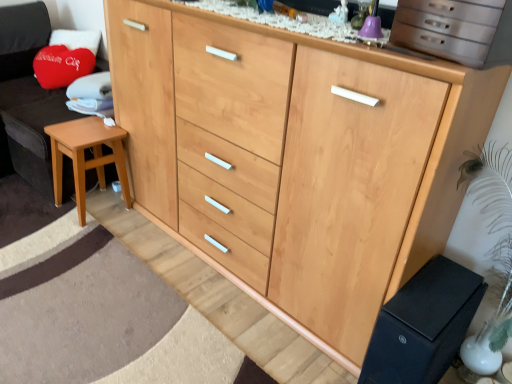
At what (x,y) coordinates should I click in order to perform the action: click on light brown wood stool at lower left. Please return your answer as a coordinate pair (x, y). The image size is (512, 384). Looking at the image, I should click on (87, 160).

Where is `wooden stool at left`? The image size is (512, 384). wooden stool at left is located at coordinates (29, 118).

Find the location of `light brown wood stool at lower left`. light brown wood stool at lower left is located at coordinates (87, 160).

How far apart are black matte changing table at lower right and wooden stool at left?

They are 6.27 feet apart.

Looking at this image, considering the sizes of objects black matte changing table at lower right and wooden stool at left in the image provided, who is thinner, black matte changing table at lower right or wooden stool at left?

black matte changing table at lower right.

I want to click on changing table below the wooden stool at left (from a real-world perspective), so click(423, 325).

From the image's perspective, who appears lower, black matte changing table at lower right or wooden stool at left?

black matte changing table at lower right appears lower in the image.

Is light brown wood stool at lower left spatially inside black matte changing table at lower right, or outside of it?

light brown wood stool at lower left cannot be found inside black matte changing table at lower right.

What's the angular difference between light brown wood stool at lower left and black matte changing table at lower right's facing directions?

The facing directions of light brown wood stool at lower left and black matte changing table at lower right are 2.89 degrees apart.

Measure the distance between light brown wood stool at lower left and black matte changing table at lower right.

light brown wood stool at lower left and black matte changing table at lower right are 1.59 meters apart from each other.

Which object is further away from the camera taking this photo, light brown wood stool at lower left or black matte changing table at lower right?

light brown wood stool at lower left is further away from the camera.

What's the angular difference between black matte changing table at lower right and metallic silver drawers at upper right's facing directions?

9.98 degrees.

From the picture: Considering the sizes of black matte changing table at lower right and metallic silver drawers at upper right in the image, is black matte changing table at lower right taller or shorter than metallic silver drawers at upper right?

Considering their sizes, black matte changing table at lower right has more height than metallic silver drawers at upper right.

Looking at this image, between black matte changing table at lower right and metallic silver drawers at upper right, which one is positioned behind?

black matte changing table at lower right.

Considering the sizes of black matte changing table at lower right and metallic silver drawers at upper right in the image, is black matte changing table at lower right wider or thinner than metallic silver drawers at upper right?

Considering their sizes, black matte changing table at lower right looks broader than metallic silver drawers at upper right.

Considering the relative positions of wooden stool at left and light brown wood stool at lower left in the image provided, is wooden stool at left to the right of light brown wood stool at lower left from the viewer's perspective?

No, wooden stool at left is not to the right of light brown wood stool at lower left.

Does point (33, 23) lie in front of point (123, 191)?

No, it is not.

Are wooden stool at left and light brown wood stool at lower left making contact?

wooden stool at left and light brown wood stool at lower left are clearly separated.

Consider the image. Between wooden stool at left and light brown wood stool at lower left, which one has larger width?

With larger width is wooden stool at left.

Does metallic silver drawers at upper right appear on the right side of light brown wood stool at lower left?

Correct, you'll find metallic silver drawers at upper right to the right of light brown wood stool at lower left.

Is point (432, 38) closer or farther from the camera than point (102, 162)?

Clearly, point (432, 38) is closer to the camera than point (102, 162).

From the image's perspective, does metallic silver drawers at upper right appear lower than light brown wood stool at lower left?

No, from the image's perspective, metallic silver drawers at upper right is not beneath light brown wood stool at lower left.

Based on the photo, could you tell me if metallic silver drawers at upper right is turned towards light brown wood stool at lower left?

No, metallic silver drawers at upper right is not aimed at light brown wood stool at lower left.

Which of these two, black matte changing table at lower right or light brown wood stool at lower left, is wider?

black matte changing table at lower right is wider.

Is light brown wood stool at lower left surrounded by black matte changing table at lower right?

No, light brown wood stool at lower left is not inside black matte changing table at lower right.

From the image's perspective, who appears lower, black matte changing table at lower right or light brown wood stool at lower left?

black matte changing table at lower right, from the image's perspective.

Locate an element on the screen. This screenshot has height=384, width=512. stool that appears above the black matte changing table at lower right (from the image's perspective) is located at coordinates (87, 160).

In terms of size, does light brown wood stool at lower left appear bigger or smaller than wooden stool at left?

Considering their sizes, light brown wood stool at lower left takes up less space than wooden stool at left.

Is there a large distance between light brown wood stool at lower left and wooden stool at left?

That's not correct — light brown wood stool at lower left is a little close to wooden stool at left.

Which of these two, light brown wood stool at lower left or wooden stool at left, is wider?

Wider between the two is wooden stool at left.

Does light brown wood stool at lower left turn towards wooden stool at left?

No, light brown wood stool at lower left is not turned towards wooden stool at left.

This screenshot has width=512, height=384. I want to click on swivel chair lying behind the black matte changing table at lower right, so click(29, 118).

This screenshot has width=512, height=384. I want to click on changing table located on the right of light brown wood stool at lower left, so click(423, 325).

Estimate the real-world distances between objects in this image. Which object is further from light brown wood stool at lower left, metallic silver drawers at upper right or wooden stool at left?

metallic silver drawers at upper right.

When comparing their distances from black matte changing table at lower right, does metallic silver drawers at upper right or light brown wood stool at lower left seem closer?

metallic silver drawers at upper right is positioned closer to the anchor black matte changing table at lower right.

Estimate the real-world distances between objects in this image. Which object is closer to metallic silver drawers at upper right, black matte changing table at lower right or light brown wood stool at lower left?

The object closer to metallic silver drawers at upper right is black matte changing table at lower right.

Looking at the image, which one is located closer to metallic silver drawers at upper right, light brown wood stool at lower left or wooden stool at left?

light brown wood stool at lower left is positioned closer to the anchor metallic silver drawers at upper right.

From the image, which object appears to be nearer to light brown wood stool at lower left, wooden stool at left or black matte changing table at lower right?

Among the two, wooden stool at left is located nearer to light brown wood stool at lower left.

When comparing their distances from black matte changing table at lower right, does metallic silver drawers at upper right or wooden stool at left seem closer?

metallic silver drawers at upper right is closer to black matte changing table at lower right.

From the picture: When comparing their distances from metallic silver drawers at upper right, does light brown wood stool at lower left or black matte changing table at lower right seem further?

Based on the image, light brown wood stool at lower left appears to be further to metallic silver drawers at upper right.

Considering their positions, is wooden stool at left positioned closer to black matte changing table at lower right than metallic silver drawers at upper right?

metallic silver drawers at upper right lies closer to black matte changing table at lower right than the other object.

Locate an element on the screen. Image resolution: width=512 pixels, height=384 pixels. stool between wooden stool at left and black matte changing table at lower right is located at coordinates (87, 160).

Where is `cabinetry between wooden stool at left and black matte changing table at lower right from left to right`? cabinetry between wooden stool at left and black matte changing table at lower right from left to right is located at coordinates (445, 30).

In order to click on cabinetry situated between light brown wood stool at lower left and black matte changing table at lower right from left to right in this screenshot , I will do `click(445, 30)`.

Identify the location of stool situated between wooden stool at left and metallic silver drawers at upper right from left to right. (87, 160).